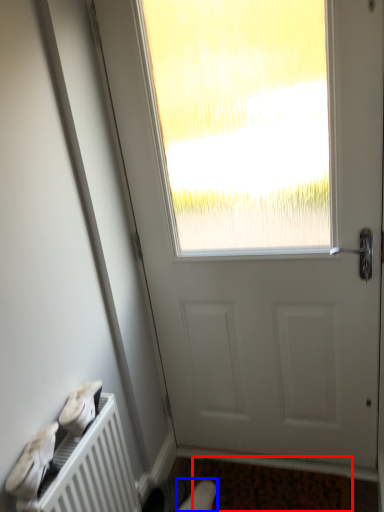
Question: Among these objects, which one is farthest to the camera, doormat (highlighted by a red box) or shoe (highlighted by a blue box)?

Choices:
 (A) doormat
 (B) shoe

Answer: (B)